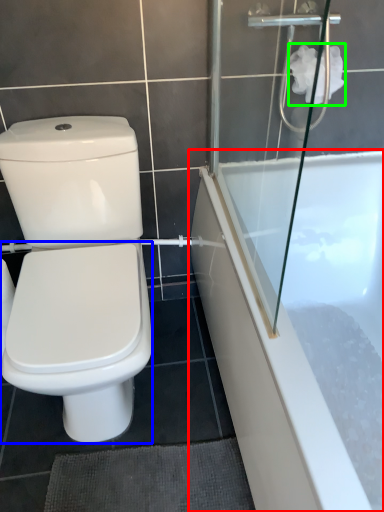
Question: Based on their relative distances, which object is farther from bathtub (highlighted by a red box)? Choose from bidet (highlighted by a blue box) and toilet paper (highlighted by a green box).

Choices:
 (A) bidet
 (B) toilet paper

Answer: (B)